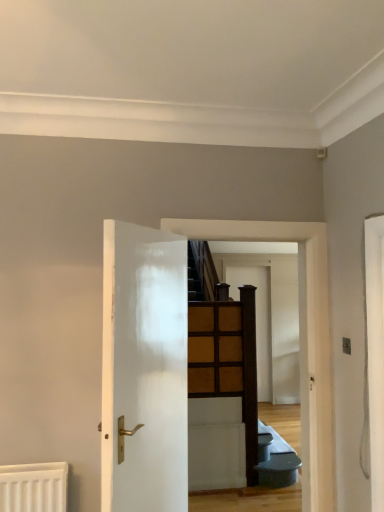
Question: Should I look upward or downward to see white glossy door at center, acting as the 2th door starting from the right?

Choices:
 (A) up
 (B) down

Answer: (B)

Question: Which direction should I rotate to face wooden at center, which ranks as the second door in front-to-back order, — up or down?

Choices:
 (A) down
 (B) up

Answer: (A)

Question: Can you confirm if white glossy door at center, the first door positioned from the left, is positioned to the left of wooden at center, which ranks as the first door in right-to-left order?

Choices:
 (A) yes
 (B) no

Answer: (A)

Question: Is wooden at center, which ranks as the second door in front-to-back order, inside white glossy door at center, acting as the 2th door starting from the right?

Choices:
 (A) no
 (B) yes

Answer: (A)

Question: Can you confirm if white glossy door at center, placed as the first door when sorted from front to back, is shorter than wooden at center, which appears as the 2th door when viewed from the left?

Choices:
 (A) no
 (B) yes

Answer: (B)

Question: Considering the relative sizes of white glossy door at center, placed as the first door when sorted from front to back, and wooden at center, placed as the 1th door when sorted from back to front, in the image provided, is white glossy door at center, placed as the first door when sorted from front to back, thinner than wooden at center, placed as the 1th door when sorted from back to front,?

Choices:
 (A) no
 (B) yes

Answer: (A)

Question: Can you confirm if white glossy door at center, acting as the 2th door starting from the right, is wider than wooden at center, which ranks as the first door in right-to-left order?

Choices:
 (A) yes
 (B) no

Answer: (A)

Question: From the image's perspective, does white glossy door at center, the 2th door from the back, appear lower than wooden at center, which appears as the 2th door when viewed from the left?

Choices:
 (A) yes
 (B) no

Answer: (B)

Question: From a real-world perspective, is wooden at center, which appears as the 2th door when viewed from the left, beneath white glossy door at center, placed as the first door when sorted from front to back?

Choices:
 (A) yes
 (B) no

Answer: (A)

Question: From the image's perspective, is wooden at center, which appears as the 2th door when viewed from the left, below white glossy door at center, the 2th door from the back?

Choices:
 (A) no
 (B) yes

Answer: (B)

Question: Is wooden at center, which ranks as the second door in front-to-back order, wider than white glossy door at center, placed as the first door when sorted from front to back?

Choices:
 (A) no
 (B) yes

Answer: (A)

Question: From a real-world perspective, is wooden at center, which appears as the 2th door when viewed from the left, over white glossy door at center, acting as the 2th door starting from the right?

Choices:
 (A) yes
 (B) no

Answer: (B)

Question: Is wooden at center, placed as the 1th door when sorted from back to front, looking in the opposite direction of white glossy door at center, placed as the first door when sorted from front to back?

Choices:
 (A) yes
 (B) no

Answer: (B)

Question: Is wooden at center, which appears as the 2th door when viewed from the left, taller than white glossy door at center, acting as the 2th door starting from the right?

Choices:
 (A) yes
 (B) no

Answer: (A)

Question: Considering the positions of point (102, 229) and point (241, 273), is point (102, 229) closer or farther from the camera than point (241, 273)?

Choices:
 (A) farther
 (B) closer

Answer: (B)